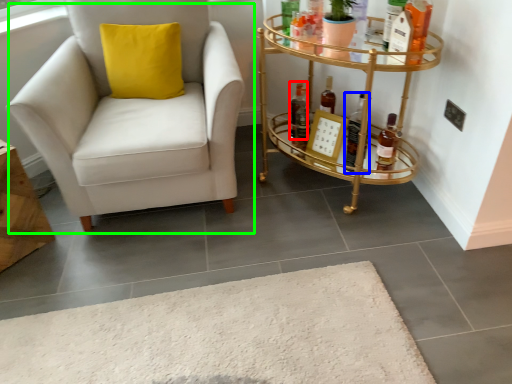
Question: Which is farther away from bottle (highlighted by a red box)? bottle (highlighted by a blue box) or chair (highlighted by a green box)?

Choices:
 (A) bottle
 (B) chair

Answer: (B)